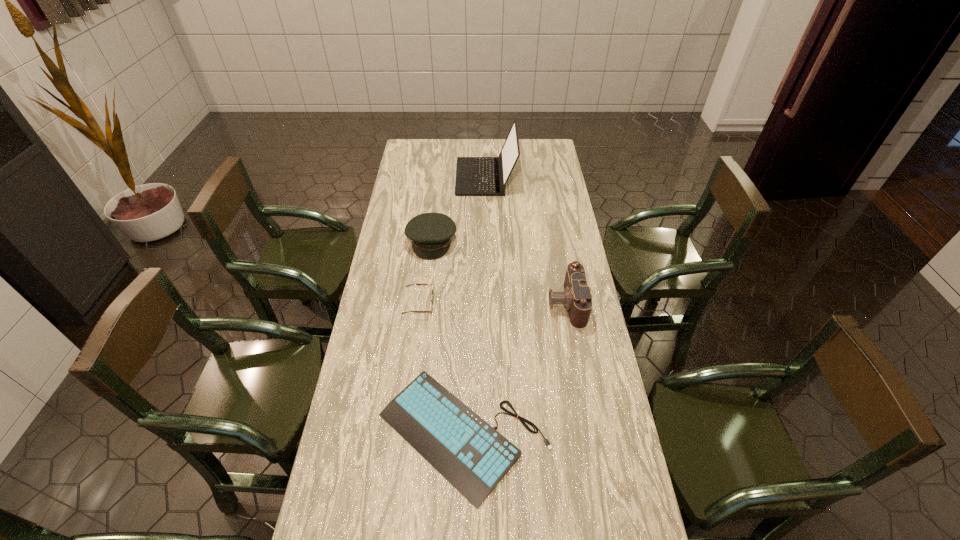
I want to click on the farthest object, so click(x=475, y=176).

Identify the location of the tallest object. Image resolution: width=960 pixels, height=540 pixels. (475, 176).

In order to click on the second tallest object in this screenshot , I will do `click(576, 297)`.

Locate an element on the screen. The width and height of the screenshot is (960, 540). camera is located at coordinates (576, 297).

Identify the location of the third shortest object. (431, 233).

Find the location of a particular element. beret is located at coordinates (431, 233).

Find the location of a particular element. Image resolution: width=960 pixels, height=540 pixels. spectacles is located at coordinates click(x=432, y=297).

You are a GUI agent. You are given a task and a screenshot of the screen. Output one action in this format:
    pyautogui.click(x=<x>, y=<y>)
    Task: Click on the shortest object
    This screenshot has height=540, width=960.
    Given the screenshot: What is the action you would take?
    pyautogui.click(x=473, y=456)

Image resolution: width=960 pixels, height=540 pixels. I want to click on the nearest object, so click(473, 456).

The height and width of the screenshot is (540, 960). I want to click on vacant space located on the surface of the farthest object, so (x=409, y=177).